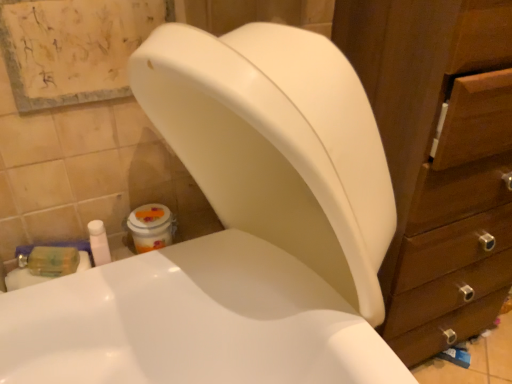
The height and width of the screenshot is (384, 512). Describe the element at coordinates (99, 242) in the screenshot. I see `white plastic bottle at lower left` at that location.

In order to face white plastic bottle at lower left, should I rotate leftwards or rightwards?

You should look left and rotate roughly 18.966 degrees.

At what (x,y) coordinates should I click in order to perform the action: click on white plastic bottle at lower left. Please return your answer as a coordinate pair (x, y). Image resolution: width=512 pixels, height=384 pixels. Looking at the image, I should click on (99, 242).

What do you see at coordinates (439, 159) in the screenshot?
I see `wooden cabinet at right` at bounding box center [439, 159].

Find the location of a particular element. wooden cabinet at right is located at coordinates (439, 159).

Find the location of a particular element. This screenshot has width=512, height=384. white plastic bottle at lower left is located at coordinates (99, 242).

Is white plastic bottle at lower left to the right of wooden cabinet at right from the viewer's perspective?

No, white plastic bottle at lower left is not to the right of wooden cabinet at right.

Is the depth of white plastic bottle at lower left greater than that of wooden cabinet at right?

Yes, it is behind wooden cabinet at right.

Considering the points (98, 247) and (423, 113), which point is behind, point (98, 247) or point (423, 113)?

The point (98, 247) is farther from the camera.

From the image's perspective, who appears lower, white plastic bottle at lower left or wooden cabinet at right?

white plastic bottle at lower left appears lower in the image.

From a real-world perspective, is white plastic bottle at lower left physically located above or below wooden cabinet at right?

In terms of real-world spatial position, white plastic bottle at lower left is above wooden cabinet at right.

Which of these two, white plastic bottle at lower left or wooden cabinet at right, is wider?

wooden cabinet at right is wider.

Is white plastic bottle at lower left taller than wooden cabinet at right?

No, white plastic bottle at lower left is not taller than wooden cabinet at right.

Which of these two, white plastic bottle at lower left or wooden cabinet at right, is smaller?

Smaller between the two is white plastic bottle at lower left.

Is wooden cabinet at right completely or partially inside white plastic bottle at lower left?

That's incorrect, wooden cabinet at right is not inside white plastic bottle at lower left.

Is the surface of white plastic bottle at lower left in direct contact with wooden cabinet at right?

No, white plastic bottle at lower left is not beside wooden cabinet at right.

Is white plastic bottle at lower left turned away from wooden cabinet at right?

No, white plastic bottle at lower left is not facing the opposite direction of wooden cabinet at right.

Based on the photo, how different are the orientations of white plastic bottle at lower left and wooden cabinet at right in degrees?

The angle between the facing direction of white plastic bottle at lower left and the facing direction of wooden cabinet at right is 4.36 degrees.

Measure the distance between white plastic bottle at lower left and wooden cabinet at right.

They are 28.76 inches apart.

Locate an element on the screen. This screenshot has height=384, width=512. cabinet on the right side of white plastic bottle at lower left is located at coordinates (439, 159).

Between wooden cabinet at right and white plastic bottle at lower left, which one appears on the left side from the viewer's perspective?

From the viewer's perspective, white plastic bottle at lower left appears more on the left side.

In the image, is wooden cabinet at right positioned in front of or behind white plastic bottle at lower left?

Clearly, wooden cabinet at right is in front of white plastic bottle at lower left.

Which is nearer, (501,304) or (95,261)?

Point (501,304) is positioned farther from the camera compared to point (95,261).

From the image's perspective, is wooden cabinet at right on white plastic bottle at lower left?

Yes, from the image's perspective, wooden cabinet at right is on top of white plastic bottle at lower left.

From a real-world perspective, is wooden cabinet at right positioned above or below white plastic bottle at lower left?

Clearly, from a real-world perspective, wooden cabinet at right is below white plastic bottle at lower left.

Consider the image. Is wooden cabinet at right wider than white plastic bottle at lower left?

Indeed, wooden cabinet at right has a greater width compared to white plastic bottle at lower left.

From their relative heights in the image, would you say wooden cabinet at right is taller or shorter than white plastic bottle at lower left?

Considering their sizes, wooden cabinet at right has more height than white plastic bottle at lower left.

Does wooden cabinet at right have a larger size compared to white plastic bottle at lower left?

Yes.

Is wooden cabinet at right located outside white plastic bottle at lower left?

Absolutely, wooden cabinet at right is external to white plastic bottle at lower left.

Based on the photo, is wooden cabinet at right not near white plastic bottle at lower left?

No, wooden cabinet at right is not far from white plastic bottle at lower left.

Is wooden cabinet at right facing towards white plastic bottle at lower left?

No, wooden cabinet at right is not aimed at white plastic bottle at lower left.

Identify the location of cabinet that appears above the white plastic bottle at lower left (from the image's perspective). The height and width of the screenshot is (384, 512). (439, 159).

Locate an element on the screen. cabinet beneath the white plastic bottle at lower left (from a real-world perspective) is located at coordinates (439, 159).

Image resolution: width=512 pixels, height=384 pixels. What are the coordinates of `toiletry behind the wooden cabinet at right` in the screenshot? It's located at (99, 242).